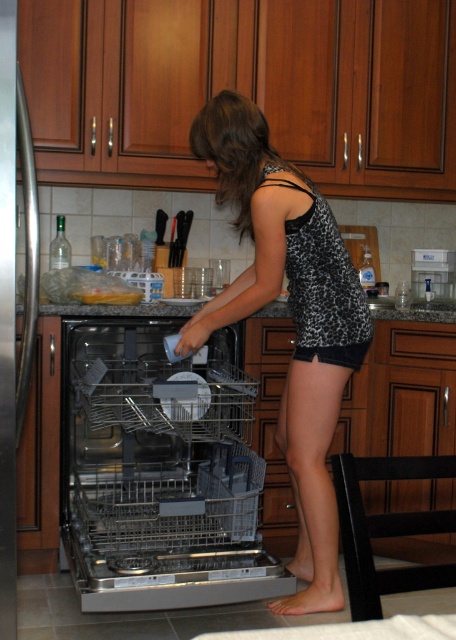
Question: Among these objects, which one is nearest to the camera?

Choices:
 (A) metallic gray dishwasher at center
 (B) black leopard print tank top at center

Answer: (A)

Question: Does metallic gray dishwasher at center appear over black leopard print tank top at center?

Choices:
 (A) no
 (B) yes

Answer: (A)

Question: In this image, where is metallic gray dishwasher at center located relative to black leopard print tank top at center?

Choices:
 (A) above
 (B) below

Answer: (B)

Question: Which of the following is the farthest from the observer?

Choices:
 (A) (218, 381)
 (B) (322, 236)

Answer: (A)

Question: Is metallic gray dishwasher at center bigger than black leopard print tank top at center?

Choices:
 (A) yes
 (B) no

Answer: (A)

Question: Which object appears closest to the camera in this image?

Choices:
 (A) black leopard print tank top at center
 (B) metallic gray dishwasher at center

Answer: (B)